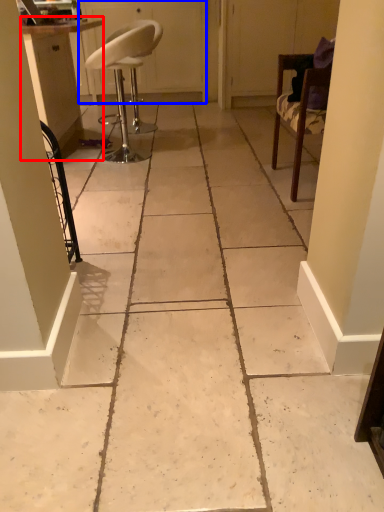
Question: Among these objects, which one is nearest to the camera, cabinetry (highlighted by a red box) or screen door (highlighted by a blue box)?

Choices:
 (A) cabinetry
 (B) screen door

Answer: (A)